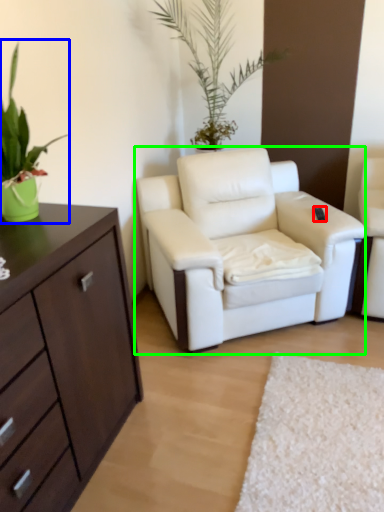
Question: Estimate the real-world distances between objects in this image. Which object is closer to remote control (highlighted by a red box), houseplant (highlighted by a blue box) or chair (highlighted by a green box)?

Choices:
 (A) houseplant
 (B) chair

Answer: (B)